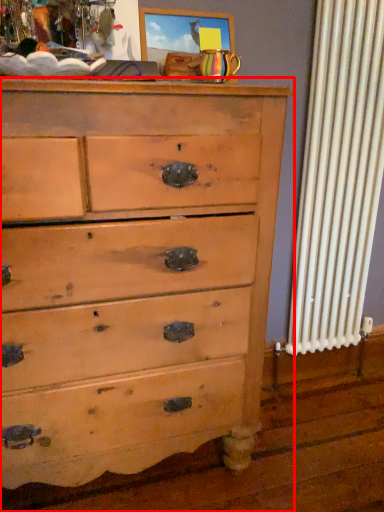
Question: From the image's perspective, what is the correct spatial relationship of chest of drawers (annotated by the red box) in relation to picture frame?

Choices:
 (A) above
 (B) below

Answer: (B)